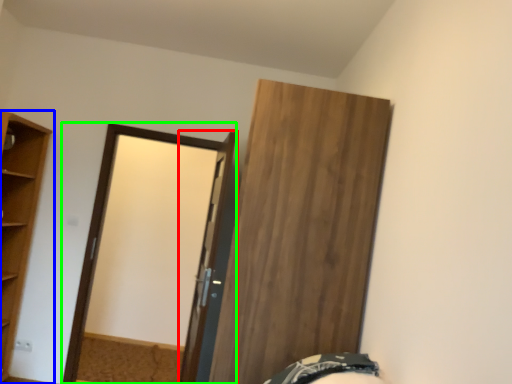
Question: Which object is positioned farthest from door (highlighted by a red box)? Select from cupboard (highlighted by a blue box) and screen door (highlighted by a green box).

Choices:
 (A) cupboard
 (B) screen door

Answer: (A)